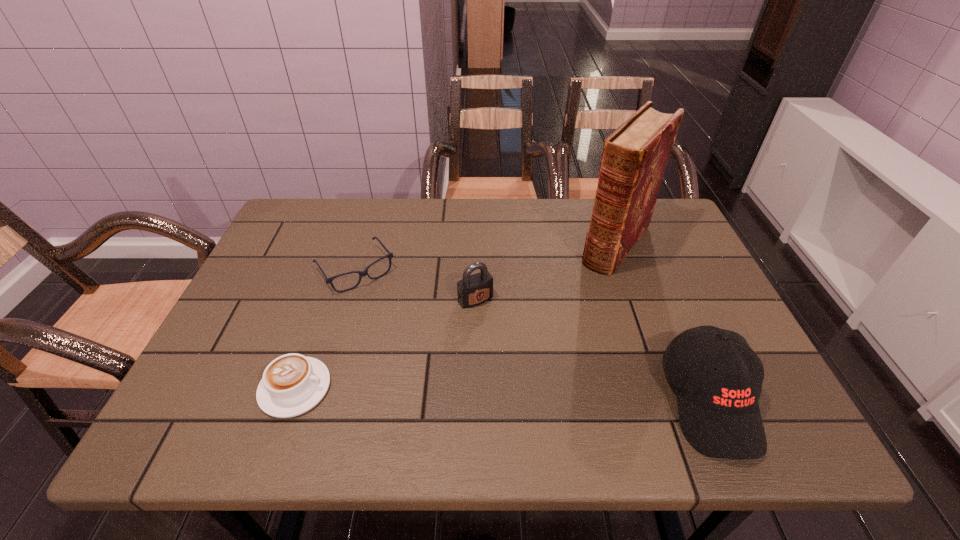
Locate an element on the screen. empty space between the spectacles and the padlock is located at coordinates (416, 285).

Select which object is the third closest to the spectacles. Please provide its 2D coordinates. Your answer should be formatted as a tuple, i.e. [(x, y)], where the tuple contains the x and y coordinates of a point satisfying the conditions above.

[(634, 158)]

Where is `object that is the third closest one to the baseball cap`? object that is the third closest one to the baseball cap is located at coordinates (361, 273).